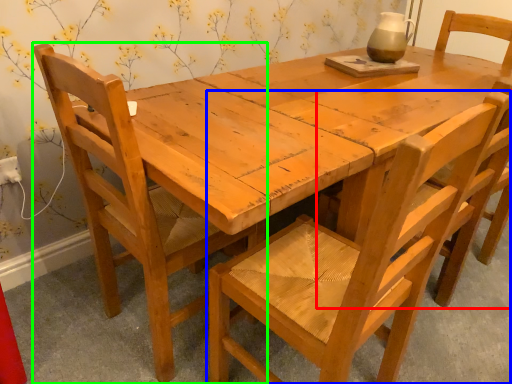
Question: Based on their relative distances, which object is nearer to chair (highlighted by a red box)? Choose from chair (highlighted by a blue box) and chair (highlighted by a green box).

Choices:
 (A) chair
 (B) chair

Answer: (A)